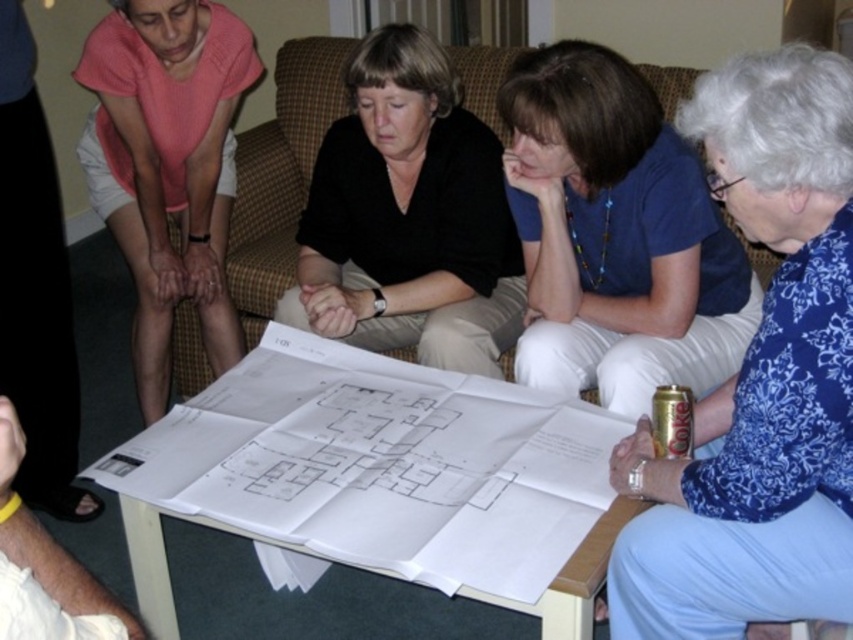
Question: Is blue floral blouse at lower right bigger than blue fabric shirt at center?

Choices:
 (A) no
 (B) yes

Answer: (A)

Question: Does blue floral blouse at lower right have a greater width compared to blue fabric shirt at center?

Choices:
 (A) no
 (B) yes

Answer: (A)

Question: Which object is the closest to the black matte shirt at center?

Choices:
 (A) pink cotton shirt at upper left
 (B) blue floral blouse at lower right
 (C) brown fabric couch at center

Answer: (C)

Question: Among these points, which one is nearest to the camera?

Choices:
 (A) (263, 173)
 (B) (822, 456)
 (C) (618, 189)

Answer: (B)

Question: Which point is farther to the camera?

Choices:
 (A) (90, 129)
 (B) (468, 332)
 (C) (793, 264)
 (D) (300, 90)

Answer: (D)

Question: Can you confirm if white paper at center is positioned below blue floral blouse at lower right?

Choices:
 (A) no
 (B) yes

Answer: (B)